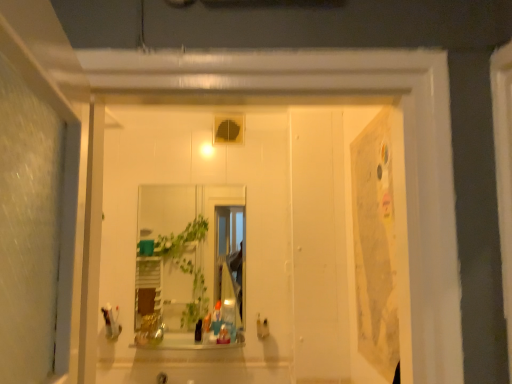
Image resolution: width=512 pixels, height=384 pixels. I want to click on vacant area on top of clear glass mirror at center (from a real-world perspective), so click(188, 180).